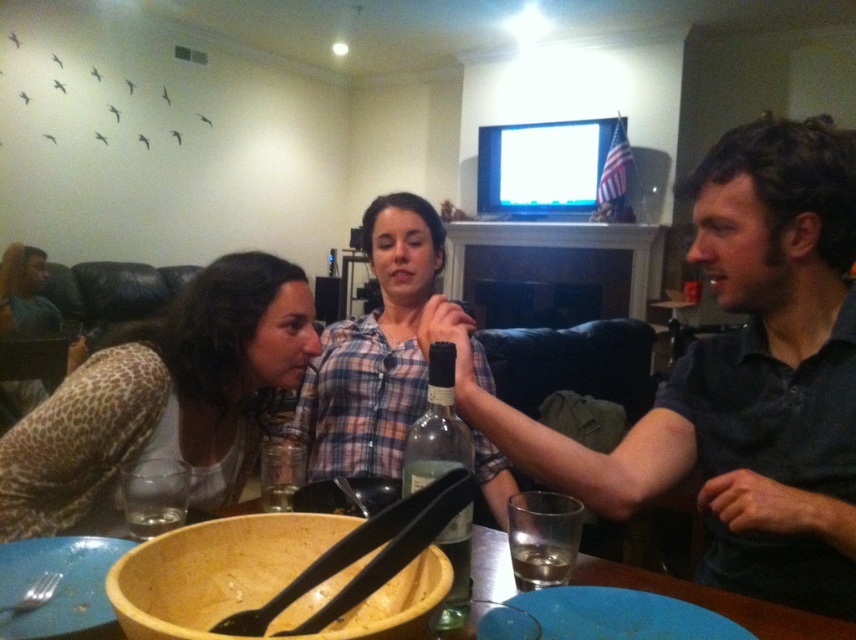
You are hosting a dinner party and want to place a green glass bottle at center on the table. However, there is a dark gray shirt at center already occupying space. Can the bottle be placed without moving the shirt?

The dark gray shirt at center might be wider than green glass bottle at center, so there might not be enough space to place the bottle without moving the shirt.

You are standing in the living room and want to move from one point to another. If you start at point (834,220) and walk towards point (128,387), will you be moving away from or towards the viewer?

Since point (834,220) is closer to the viewer than point (128,387), moving from point (834,220) to point (128,387) means you are moving away from the viewer.

You are a guest at the gathering and want to place a small snack between the green glass bottle at center and the transparent glass at table center. What is the minimum distance you need to leave between them to ensure they are not touching?

The minimum distance you need to leave between the green glass bottle at center and the transparent glass at table center is 15.36 inches to ensure they are not touching.